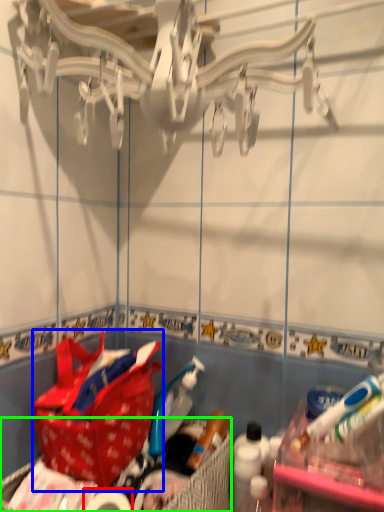
Question: Estimate the real-world distances between objects in this image. Which object is farther from toilet paper (highlighted by a red box), handbag (highlighted by a blue box) or picnic basket (highlighted by a green box)?

Choices:
 (A) handbag
 (B) picnic basket

Answer: (A)